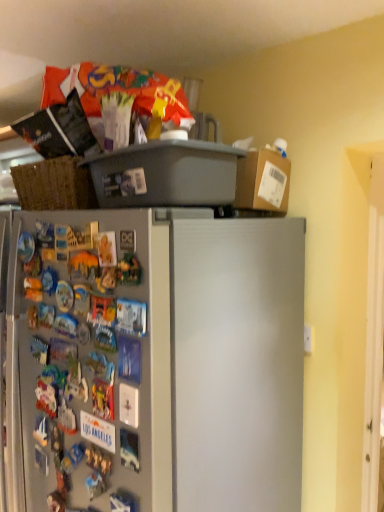
The height and width of the screenshot is (512, 384). What do you see at coordinates (153, 362) in the screenshot?
I see `gray matte refrigerator at upper left` at bounding box center [153, 362].

Image resolution: width=384 pixels, height=512 pixels. Identify the location of gray matte refrigerator at upper left. (153, 362).

Identify the location of gray matte refrigerator at upper left. The width and height of the screenshot is (384, 512). (153, 362).